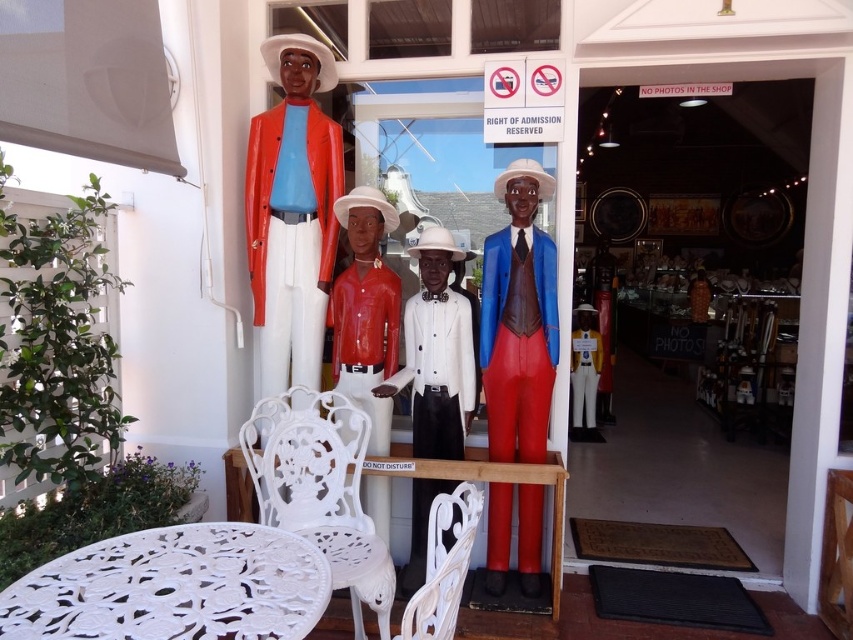
Question: In this image, where is white glossy suit at center located relative to white wrought iron table at center?

Choices:
 (A) right
 (B) left

Answer: (B)

Question: Is white carved wood table at lower left below matte blue suit at center?

Choices:
 (A) no
 (B) yes

Answer: (B)

Question: Is white carved wood table at lower left smaller than matte blue suit at center?

Choices:
 (A) no
 (B) yes

Answer: (B)

Question: Which point is closer to the camera?

Choices:
 (A) (296, 468)
 (B) (344, 218)

Answer: (A)

Question: Estimate the real-world distances between objects in this image. Which object is farther from the white cast iron chair at lower left?

Choices:
 (A) white wrought iron table at center
 (B) white carved wood table at lower left
 (C) matte red mannequin at center
 (D) white wrought iron chair at lower center

Answer: (D)

Question: Which of these objects is positioned closest to the white carved wood table at lower left?

Choices:
 (A) white wrought iron chair at lower center
 (B) white cast iron chair at lower left

Answer: (A)